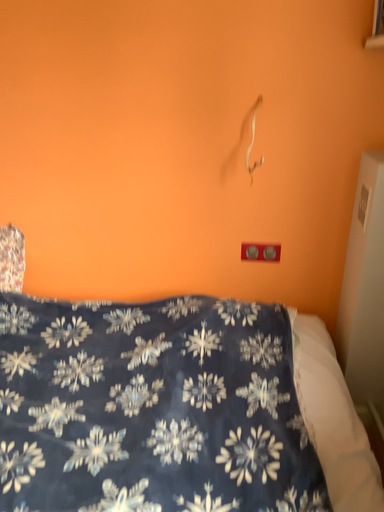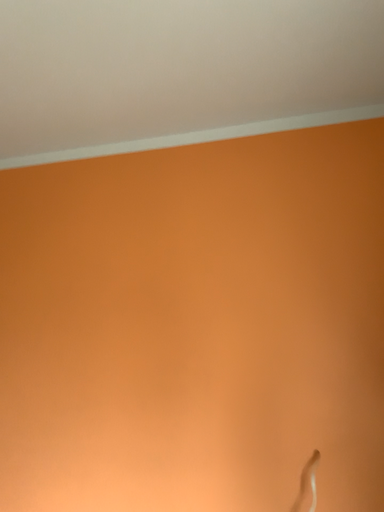
Question: Which way did the camera rotate in the video?

Choices:
 (A) rotated left
 (B) rotated right

Answer: (A)